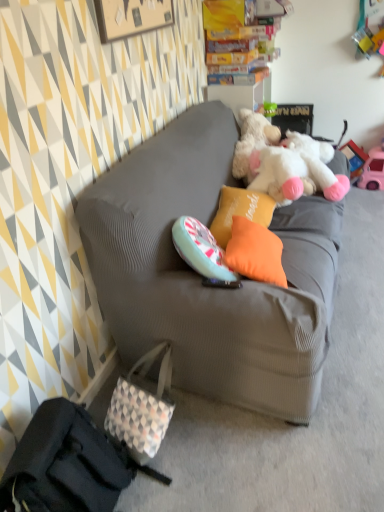
Question: Should I look upward or downward to see orange fabric pillow at center, the first pillow in the front-to-back sequence?

Choices:
 (A) down
 (B) up

Answer: (B)

Question: From the image's perspective, is white checkered fabric handbag at lower left, the first handbag when ordered from back to front, on top of orange fabric pillow at center, which ranks as the 2th pillow in back-to-front order?

Choices:
 (A) yes
 (B) no

Answer: (B)

Question: Is white checkered fabric handbag at lower left, the first handbag when ordered from back to front, further to camera compared to orange fabric pillow at center, which ranks as the 2th pillow in back-to-front order?

Choices:
 (A) yes
 (B) no

Answer: (B)

Question: From a real-world perspective, is white checkered fabric handbag at lower left, the 2th handbag viewed from the front, located beneath orange fabric pillow at center, which ranks as the 2th pillow in back-to-front order?

Choices:
 (A) yes
 (B) no

Answer: (A)

Question: Can you confirm if white checkered fabric handbag at lower left, the first handbag when ordered from back to front, is positioned to the right of orange fabric pillow at center, which ranks as the 2th pillow in back-to-front order?

Choices:
 (A) yes
 (B) no

Answer: (B)

Question: Is white checkered fabric handbag at lower left, the 2th handbag viewed from the front, at the left side of orange fabric pillow at center, which ranks as the 2th pillow in back-to-front order?

Choices:
 (A) no
 (B) yes

Answer: (B)

Question: Is orange fabric pillow at center, which ranks as the 2th pillow in back-to-front order, inside white checkered fabric handbag at lower left, the first handbag when ordered from back to front?

Choices:
 (A) no
 (B) yes

Answer: (A)

Question: Is white checkered fabric handbag at lower left, the first handbag when ordered from back to front, at the left side of pink plastic toy car at right?

Choices:
 (A) yes
 (B) no

Answer: (A)

Question: Considering the relative sizes of white checkered fabric handbag at lower left, the first handbag when ordered from back to front, and pink plastic toy car at right in the image provided, is white checkered fabric handbag at lower left, the first handbag when ordered from back to front, thinner than pink plastic toy car at right?

Choices:
 (A) no
 (B) yes

Answer: (A)

Question: Considering the relative sizes of white checkered fabric handbag at lower left, the 2th handbag viewed from the front, and pink plastic toy car at right in the image provided, is white checkered fabric handbag at lower left, the 2th handbag viewed from the front, shorter than pink plastic toy car at right?

Choices:
 (A) no
 (B) yes

Answer: (A)

Question: Are white checkered fabric handbag at lower left, the 2th handbag viewed from the front, and pink plastic toy car at right far apart?

Choices:
 (A) no
 (B) yes

Answer: (B)

Question: Is white checkered fabric handbag at lower left, the 2th handbag viewed from the front, behind pink plastic toy car at right?

Choices:
 (A) no
 (B) yes

Answer: (A)

Question: Is white checkered fabric handbag at lower left, the first handbag when ordered from back to front, facing towards pink plastic toy car at right?

Choices:
 (A) no
 (B) yes

Answer: (A)

Question: From a real-world perspective, is pink plastic toy car at right positioned under gray fabric couch at center based on gravity?

Choices:
 (A) yes
 (B) no

Answer: (A)